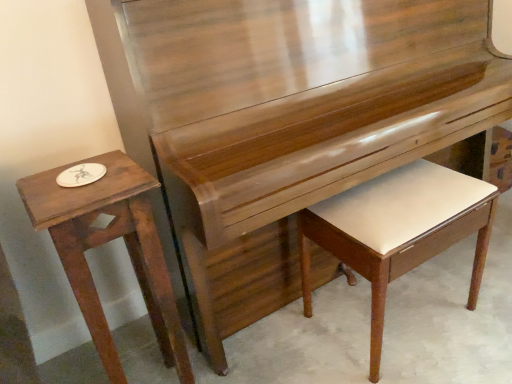
Locate an element on the screen. vacant area located to the right-hand side of wooden table at left is located at coordinates (236, 362).